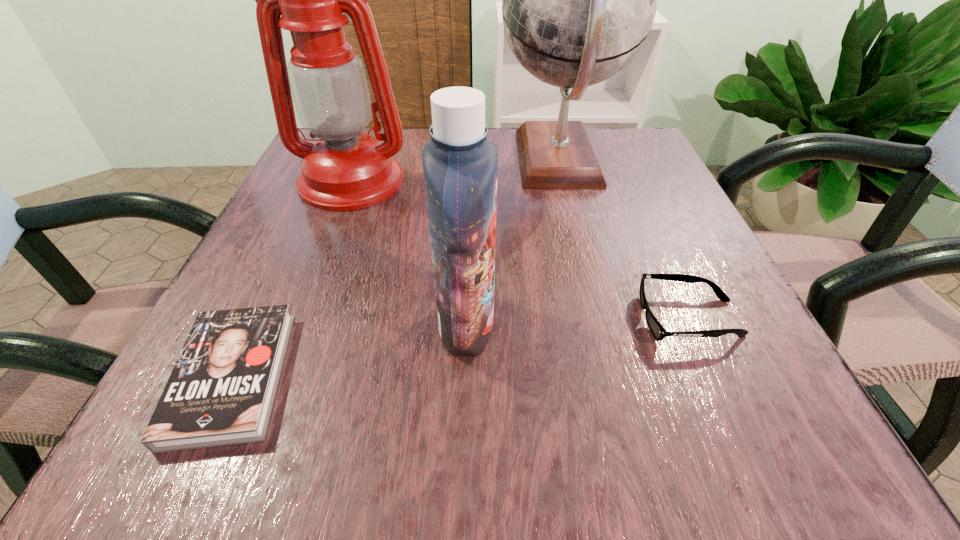
I want to click on globe, so click(579, 0).

You are a GUI agent. You are given a task and a screenshot of the screen. Output one action in this format:
    pyautogui.click(x=<x>, y=<y>)
    Task: Click on the oil lamp
    
    Given the screenshot: What is the action you would take?
    pyautogui.click(x=344, y=170)

Image resolution: width=960 pixels, height=540 pixels. I want to click on the third tallest object, so click(460, 164).

Where is `shampoo`? shampoo is located at coordinates (460, 164).

The width and height of the screenshot is (960, 540). I want to click on the second shortest object, so click(659, 333).

Where is `book`? The width and height of the screenshot is (960, 540). book is located at coordinates (221, 391).

The image size is (960, 540). In order to click on vacant region located 0.190m at the equator of the globe in this screenshot , I will do `click(409, 161)`.

Identify the location of blank space located 0.180m at the equator of the globe. (414, 161).

This screenshot has height=540, width=960. Identify the location of vacant space located 0.220m at the equator of the globe. (396, 161).

This screenshot has height=540, width=960. I want to click on vacant area located on the right of the oil lamp, so click(x=577, y=181).